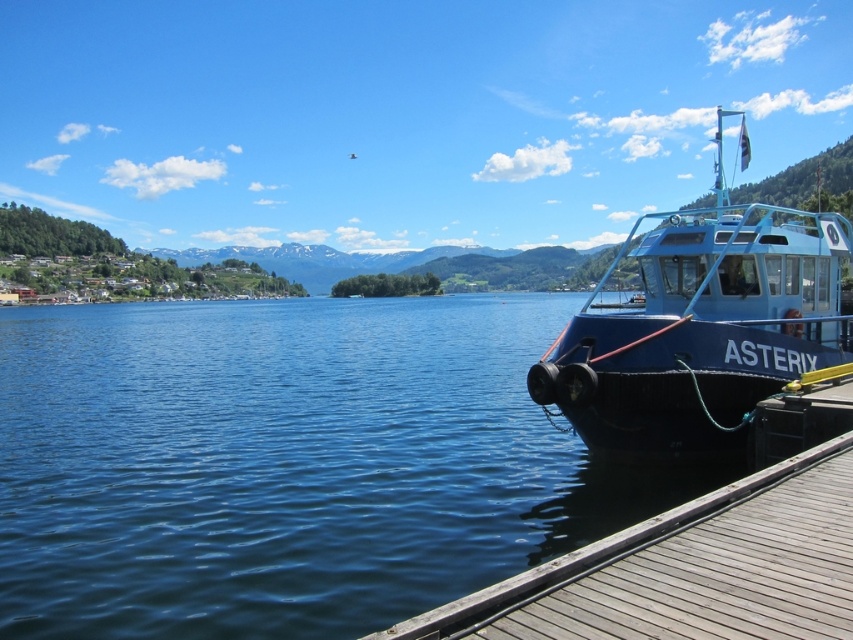
Between blue matte boat at right and wooden at right, which one has less height?

With less height is wooden at right.

Who is positioned more to the left, blue matte boat at right or wooden at right?

Positioned to the left is wooden at right.

Find the location of a particular element. The height and width of the screenshot is (640, 853). blue matte boat at right is located at coordinates (701, 326).

The height and width of the screenshot is (640, 853). In order to click on blue matte boat at right in this screenshot , I will do `click(701, 326)`.